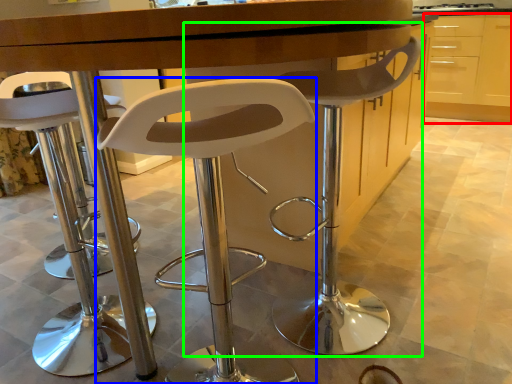
Question: Estimate the real-world distances between objects in this image. Which object is farther from cabinetry (highlighted by a red box), chair (highlighted by a blue box) or chair (highlighted by a green box)?

Choices:
 (A) chair
 (B) chair

Answer: (A)